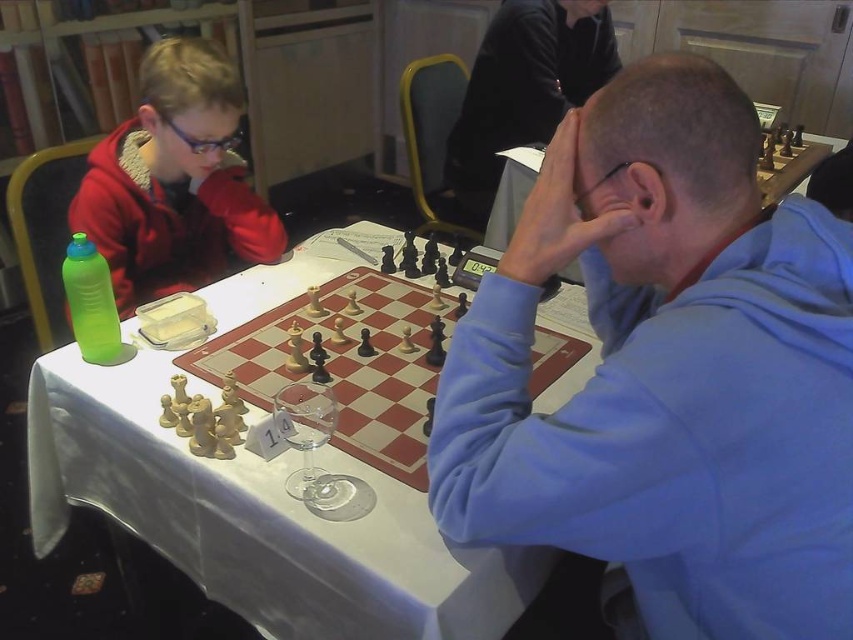
You are a chess player sitting at the table. You want to place your coffee cup on the white cloth table at center without disturbing the wooden chess set at center. Is there enough space between them to do this?

The white cloth table at center is 11.26 centimeters away from the wooden chess set at center. Since the distance is sufficient, you can place your coffee cup on the white cloth table at center without disturbing the wooden chess set at center.

You are a chess player who wants to place a large trophy on the table without covering any chess pieces. Given that the wooden chess set at center is smaller than the white cloth table at center, can you fit the trophy on the table while keeping it away from the chess pieces?

Since the white cloth table at center is wider than the wooden chess set at center, there is extra space around the chess set where the trophy can be placed without covering any pieces.

You are a photographer trying to capture a closeup of the wooden chessboard at center without the matte red jacket at upper left blocking the shot. Can you fit the entire chessboard into the frame if you position your camera directly facing the table?

The matte red jacket at upper left might be wider than wooden chessboard at center, so there is a possibility that the jacket could block part of the chessboard. To ensure the entire chessboard is visible, you might need to adjust the camera angle or move the jacket slightly.